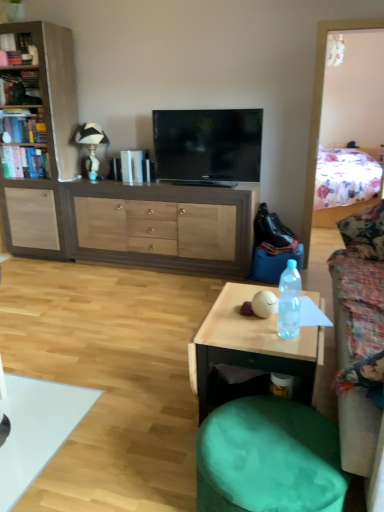
Question: From a real-world perspective, is clear plastic bottle at center physically located above or below matte wood cabinet at left?

Choices:
 (A) above
 (B) below

Answer: (B)

Question: In terms of height, does clear plastic bottle at center look taller or shorter compared to matte wood cabinet at left?

Choices:
 (A) tall
 (B) short

Answer: (B)

Question: Which is nearer to the floral fabric bed at upper right?

Choices:
 (A) hardcover book at left, the second book from the bottom
 (B) white ceramic lamp at upper left
 (C) wooden table at center
 (D) green fabric swivel chair at lower right
 (E) floral fabric couch at right

Answer: (E)

Question: Estimate the real-world distances between objects in this image. Which object is closer to the brown wood cabinet at center?

Choices:
 (A) floral fabric bed at upper right
 (B) white ceramic lamp at upper left
 (C) matte wood cabinet at left
 (D) floral fabric couch at right
 (E) hardcover book at upper left, which is counted as the first book, starting from the top

Answer: (C)